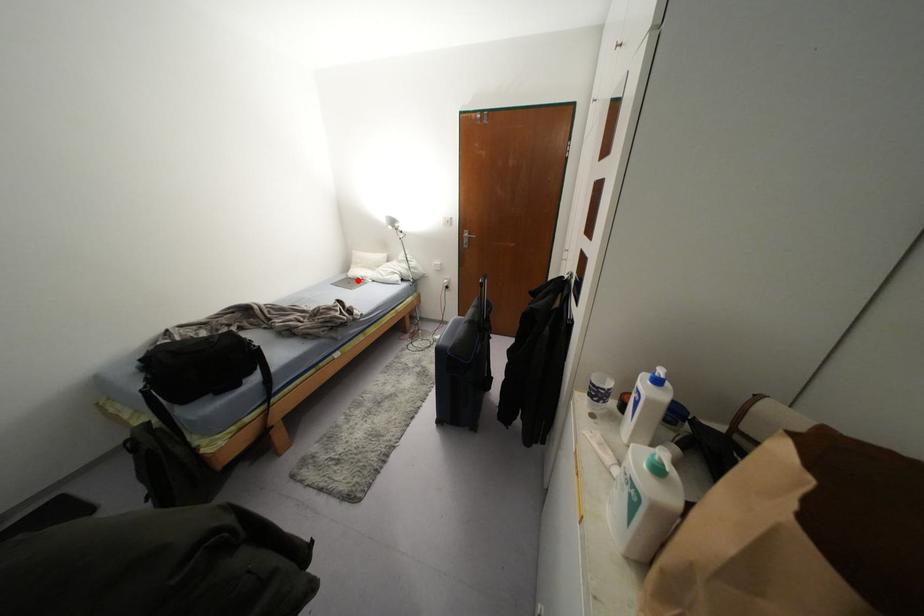
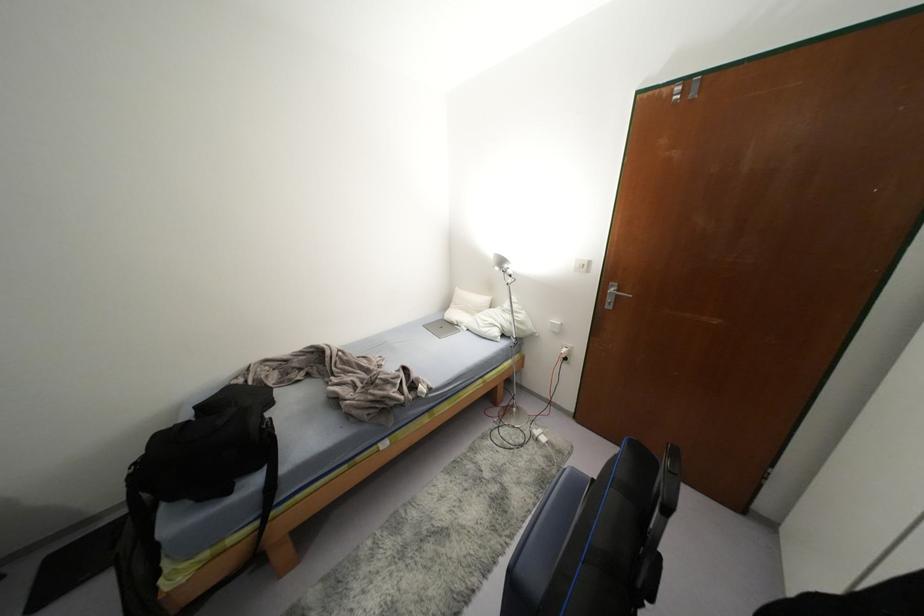
Where in the second image is the point corresponding to the highlighted location from the first image?

(452, 325)